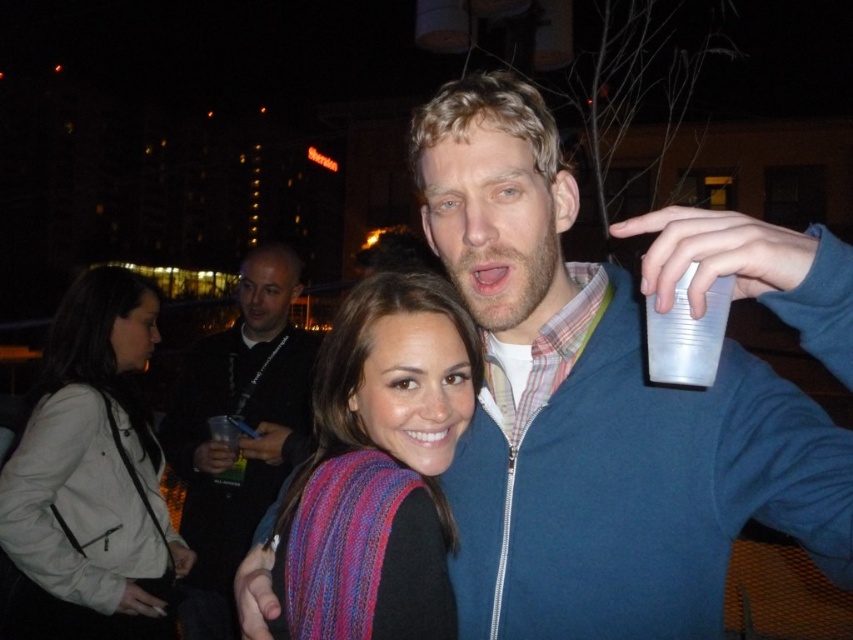
Question: Does white leather jacket at lower left appear on the right side of transparent plastic cup at upper right?

Choices:
 (A) no
 (B) yes

Answer: (A)

Question: Which point is closer to the camera?

Choices:
 (A) (709, 289)
 (B) (199, 593)
 (C) (68, 417)

Answer: (A)

Question: Which object appears farthest from the camera in this image?

Choices:
 (A) multicolored knitted scarf at center
 (B) transparent plastic cup at upper right
 (C) white leather jacket at lower left

Answer: (C)

Question: Does multicolored knitted scarf at center appear over transparent plastic cup at upper right?

Choices:
 (A) yes
 (B) no

Answer: (B)

Question: Estimate the real-world distances between objects in this image. Which object is closer to the white leather jacket at lower left?

Choices:
 (A) transparent plastic cup at upper right
 (B) black fabric shirt at center

Answer: (B)

Question: Is white leather jacket at lower left wider than transparent plastic cup at upper right?

Choices:
 (A) no
 (B) yes

Answer: (B)